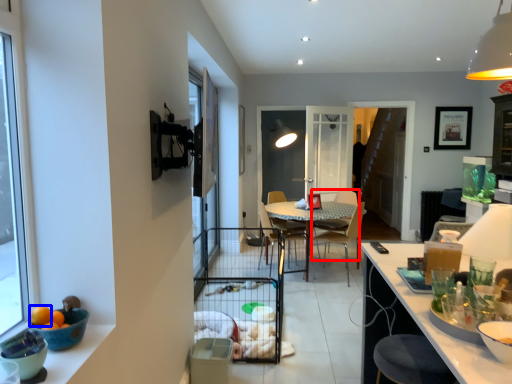
Question: Which of the following is the farthest to the observer, armchair (highlighted by a red box) or orange (highlighted by a blue box)?

Choices:
 (A) armchair
 (B) orange

Answer: (A)